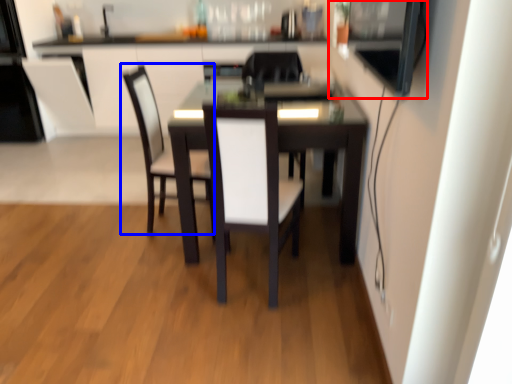
Question: Which object appears closest to the camera in this image, appliance (highlighted by a red box) or chair (highlighted by a blue box)?

Choices:
 (A) appliance
 (B) chair

Answer: (A)